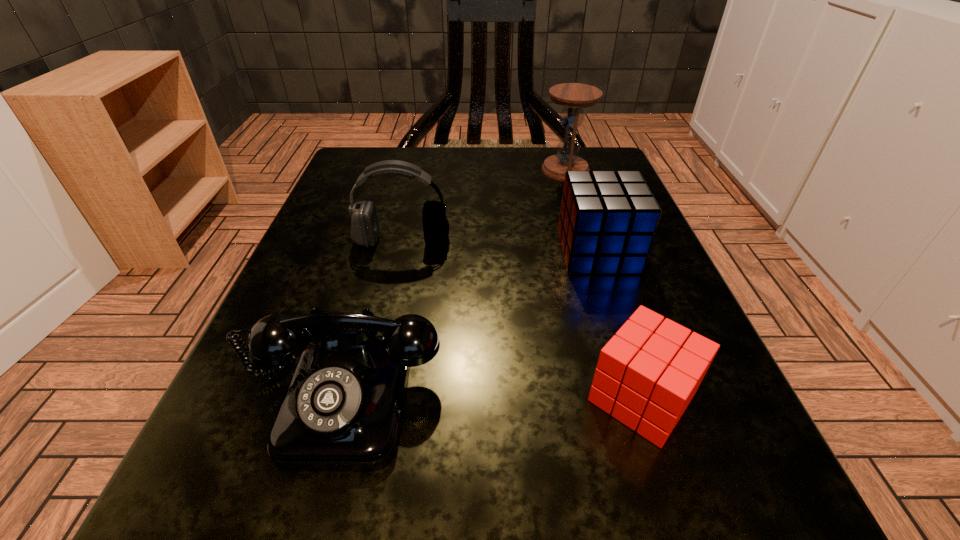
The width and height of the screenshot is (960, 540). What are the coordinates of `vacant point located 0.240m on the left of the shortest object` in the screenshot? It's located at (378, 398).

The height and width of the screenshot is (540, 960). What are the coordinates of `object positioned at the far edge` in the screenshot? It's located at (574, 97).

This screenshot has width=960, height=540. Find the location of `object at the near edge`. object at the near edge is located at coordinates (342, 411).

At what (x,y) coordinates should I click in order to perform the action: click on headset that is at the left edge. Please return your answer as a coordinate pair (x, y). Looking at the image, I should click on (364, 223).

At what (x,y) coordinates should I click in order to perform the action: click on telephone located in the left edge section of the desktop. Please return your answer as a coordinate pair (x, y). Looking at the image, I should click on (342, 411).

Where is `hourglass that is at the right edge`? The height and width of the screenshot is (540, 960). hourglass that is at the right edge is located at coordinates (574, 97).

Where is `object that is at the near left corner`? object that is at the near left corner is located at coordinates (342, 411).

The width and height of the screenshot is (960, 540). Find the location of `object positioned at the far right corner`. object positioned at the far right corner is located at coordinates (574, 97).

In the image, there is a desktop. Find the location of `vacant space at the far edge`. vacant space at the far edge is located at coordinates click(486, 151).

The image size is (960, 540). I want to click on vacant space at the left edge of the desktop, so click(x=328, y=231).